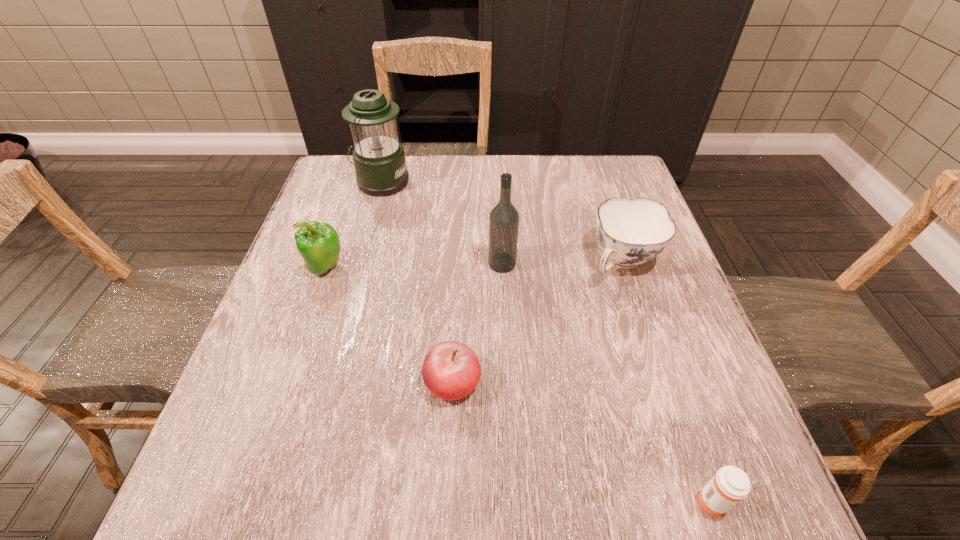
Where is `vacant area between the bell pepper and the nearest object`? The height and width of the screenshot is (540, 960). vacant area between the bell pepper and the nearest object is located at coordinates (519, 384).

Where is `vacant space that is in between the lantern and the nearest object`? The width and height of the screenshot is (960, 540). vacant space that is in between the lantern and the nearest object is located at coordinates (547, 341).

At what (x,y) coordinates should I click in order to perform the action: click on empty space that is in between the bell pepper and the nearest object. Please return your answer as a coordinate pair (x, y). Looking at the image, I should click on (519, 384).

Where is `vacant area between the lantern and the bell pepper`? This screenshot has height=540, width=960. vacant area between the lantern and the bell pepper is located at coordinates (353, 225).

This screenshot has height=540, width=960. Identify the location of vacant point located between the medicine and the second nearest object. (583, 441).

This screenshot has height=540, width=960. I want to click on the fifth closest object to the farthest object, so click(730, 484).

Locate an element on the screen. the fourth closest object to the chinaware is located at coordinates (379, 160).

Where is `vacant space that satisfies the following two spatial constraints: 1. on the front side of the farthest object; 2. on the right side of the third shortest object`? This screenshot has width=960, height=540. vacant space that satisfies the following two spatial constraints: 1. on the front side of the farthest object; 2. on the right side of the third shortest object is located at coordinates (359, 262).

Image resolution: width=960 pixels, height=540 pixels. I want to click on vacant region that satisfies the following two spatial constraints: 1. on the back side of the farthest object; 2. on the right side of the bell pepper, so click(x=355, y=182).

At what (x,y) coordinates should I click in order to perform the action: click on blank area in the image that satisfies the following two spatial constraints: 1. on the front side of the lantern; 2. on the right side of the nearest object. Please return your answer as a coordinate pair (x, y). This screenshot has width=960, height=540. Looking at the image, I should click on (294, 500).